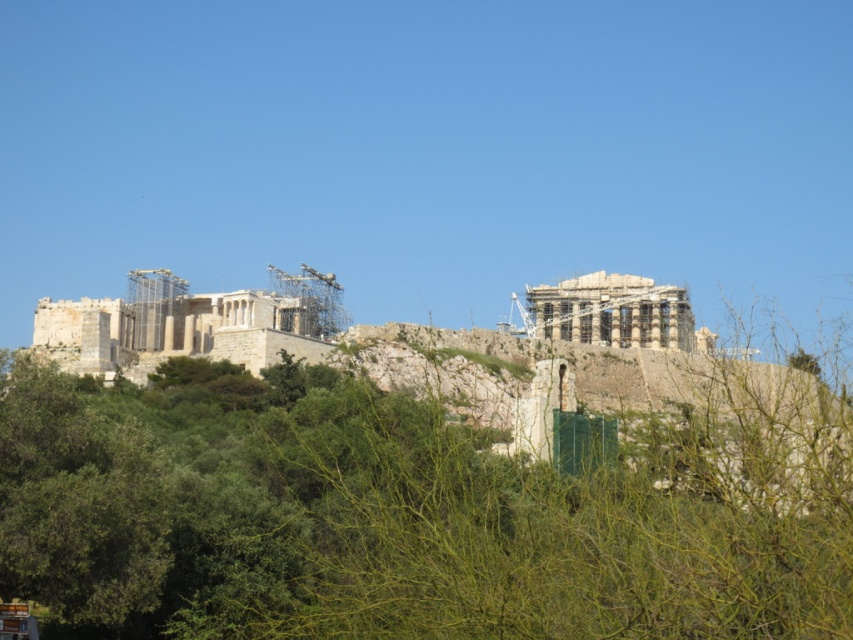
Consider the image. You are standing at the entrance of the Acropolis of Athens and want to take a photo of the Parthenon. There are two points marked as point 1 at coordinates (270, 360) and point 2 at coordinates (630, 333). Which point should you choose to ensure the Parthenon is fully visible without any scaffolding blocking the view?

Point 1 at coordinates (270, 360) is in front of point 2 at coordinates (630, 333). Since point 1 is closer to the Parthenon, it would provide a clearer view with less scaffolding obstruction.

You are standing on the Acropolis of Athens and want to take a photo of both the stone classical temple at left and the white stone temple at upper right. Which temple should you focus on first if you want to capture them both in the same frame without moving your camera?

You should focus on the stone classical temple at left first because it is closer to the viewer, allowing both it and the white stone temple at upper right to be in the same frame without needing to adjust the camera position.